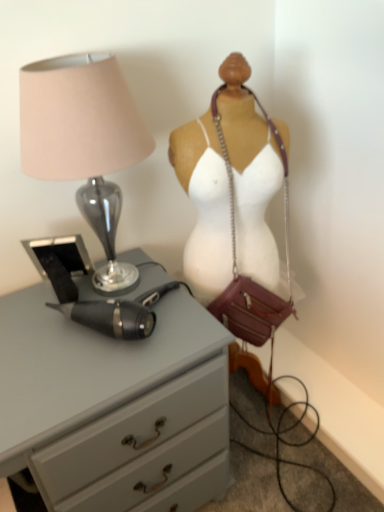
Question: From a real-world perspective, is matte gray chest of drawers at left on matte glass lamp at left?

Choices:
 (A) no
 (B) yes

Answer: (A)

Question: Is matte glass lamp at left completely or partially inside matte gray chest of drawers at left?

Choices:
 (A) yes
 (B) no

Answer: (B)

Question: Can you confirm if matte gray chest of drawers at left is wider than matte glass lamp at left?

Choices:
 (A) no
 (B) yes

Answer: (B)

Question: Would you consider matte gray chest of drawers at left to be distant from matte glass lamp at left?

Choices:
 (A) yes
 (B) no

Answer: (B)

Question: Can you confirm if matte gray chest of drawers at left is smaller than matte glass lamp at left?

Choices:
 (A) no
 (B) yes

Answer: (A)

Question: Can you confirm if matte gray chest of drawers at left is thinner than matte glass lamp at left?

Choices:
 (A) yes
 (B) no

Answer: (B)

Question: Considering the relative positions of matte glass lamp at left and leather/chain strap at center in the image provided, is matte glass lamp at left to the left of leather/chain strap at center from the viewer's perspective?

Choices:
 (A) no
 (B) yes

Answer: (B)

Question: From the image's perspective, would you say matte glass lamp at left is shown under leather/chain strap at center?

Choices:
 (A) yes
 (B) no

Answer: (B)

Question: Is matte glass lamp at left looking in the opposite direction of leather/chain strap at center?

Choices:
 (A) yes
 (B) no

Answer: (B)

Question: Does matte glass lamp at left come behind leather/chain strap at center?

Choices:
 (A) no
 (B) yes

Answer: (A)

Question: Could you tell me if matte glass lamp at left is turned towards leather/chain strap at center?

Choices:
 (A) no
 (B) yes

Answer: (A)

Question: Can you confirm if matte glass lamp at left is taller than leather/chain strap at center?

Choices:
 (A) no
 (B) yes

Answer: (A)

Question: From the image's perspective, would you say matte glass lamp at left is positioned over matte gray chest of drawers at left?

Choices:
 (A) yes
 (B) no

Answer: (A)